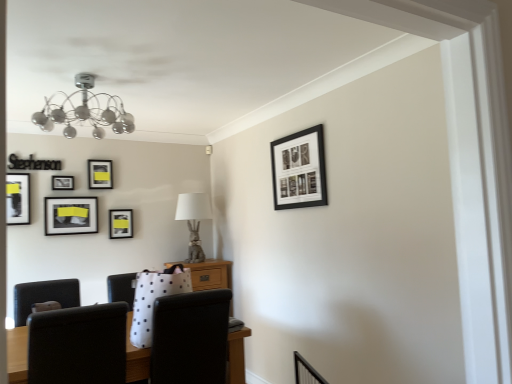
Question: From a real-world perspective, is matte black picture frame at left, positioned as the 4th picture frame in right-to-left order, below black matte picture frame at upper right, arranged as the first picture frame when viewed from the right?

Choices:
 (A) no
 (B) yes

Answer: (B)

Question: Is matte black picture frame at left, placed as the 4th picture frame when sorted from back to front, not near black matte picture frame at upper right, arranged as the first picture frame when viewed from the right?

Choices:
 (A) yes
 (B) no

Answer: (A)

Question: Is matte black picture frame at left, positioned as the third picture frame in front-to-back order, at the left side of black matte picture frame at upper right, acting as the 6th picture frame starting from the back?

Choices:
 (A) yes
 (B) no

Answer: (A)

Question: Is the position of matte black picture frame at left, positioned as the third picture frame in front-to-back order, less distant than that of black matte picture frame at upper right, the 1th picture frame positioned from the front?

Choices:
 (A) no
 (B) yes

Answer: (A)

Question: Is matte black picture frame at left, positioned as the 4th picture frame in right-to-left order, aimed at black matte picture frame at upper right, acting as the 6th picture frame starting from the back?

Choices:
 (A) no
 (B) yes

Answer: (A)

Question: Choose the correct answer: Is black matte picture frame at upper right, arranged as the first picture frame when viewed from the right, inside matte black picture frame at left, positioned as the 4th picture frame in right-to-left order, or outside it?

Choices:
 (A) inside
 (B) outside

Answer: (B)

Question: Is black matte picture frame at upper right, acting as the 6th picture frame starting from the back, taller or shorter than matte black picture frame at left, positioned as the third picture frame in front-to-back order?

Choices:
 (A) short
 (B) tall

Answer: (B)

Question: From the image's perspective, relative to matte black picture frame at left, positioned as the 4th picture frame in right-to-left order, is black matte picture frame at upper right, which is counted as the 6th picture frame, starting from the left, above or below?

Choices:
 (A) below
 (B) above

Answer: (B)

Question: Based on their positions, is black matte picture frame at upper right, acting as the 6th picture frame starting from the back, located to the left or right of matte black picture frame at left, positioned as the third picture frame in front-to-back order?

Choices:
 (A) right
 (B) left

Answer: (A)

Question: Looking at their shapes, would you say matte black picture frame at upper left, which is the third picture frame from back to front, is wider or thinner than matte black picture frame at left, placed as the 4th picture frame when sorted from back to front?

Choices:
 (A) thin
 (B) wide

Answer: (A)

Question: From the image's perspective, is matte black picture frame at upper left, which is the third picture frame from back to front, positioned above or below matte black picture frame at left, positioned as the 4th picture frame in right-to-left order?

Choices:
 (A) below
 (B) above

Answer: (B)

Question: From their relative heights in the image, would you say matte black picture frame at upper left, which is the third picture frame from back to front, is taller or shorter than matte black picture frame at left, positioned as the 4th picture frame in right-to-left order?

Choices:
 (A) tall
 (B) short

Answer: (B)

Question: Is matte black picture frame at upper left, the 2th picture frame in the left-to-right sequence, in front of or behind matte black picture frame at left, placed as the 4th picture frame when sorted from back to front, in the image?

Choices:
 (A) front
 (B) behind

Answer: (B)

Question: From a real-world perspective, relative to matte black picture frame at center left, which ranks as the first picture frame in back-to-front order, is black fabric chair at lower center vertically above or below?

Choices:
 (A) below
 (B) above

Answer: (A)

Question: From the image's perspective, is black fabric chair at lower center located above or below matte black picture frame at center left, the second picture frame from the right?

Choices:
 (A) above
 (B) below

Answer: (B)